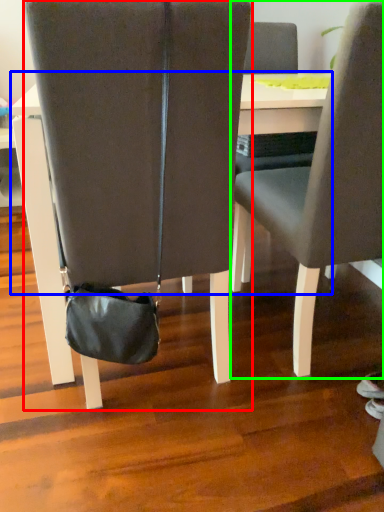
Question: Considering the real-world distances, which object is farthest from chair (highlighted by a red box)? table (highlighted by a blue box) or chair (highlighted by a green box)?

Choices:
 (A) table
 (B) chair

Answer: (B)